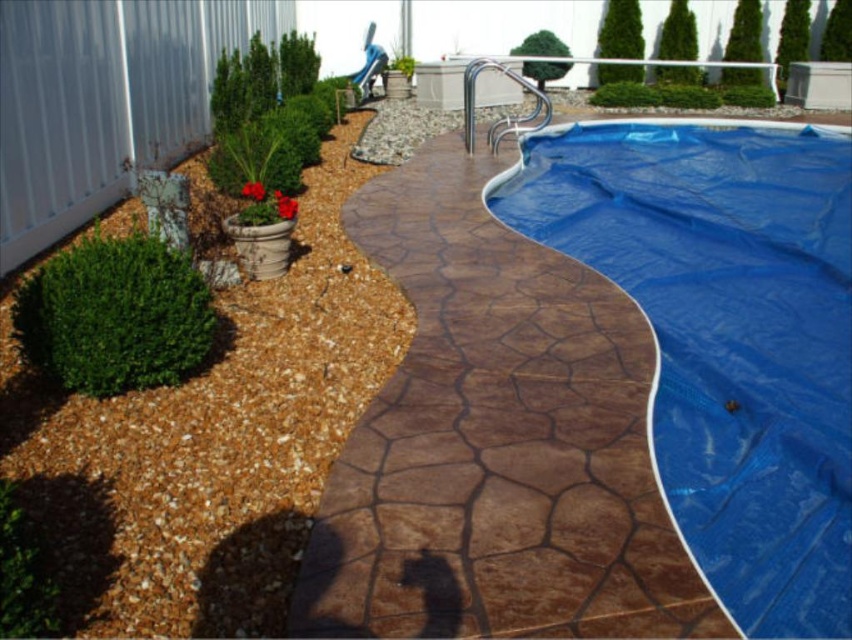
You are planning to place a rectangular picnic blanket that is 2 meters wide. You see the blue tarp at center and the brown gravel mulch at lower left. Which area can accommodate the picnic blanket without folding it?

The blue tarp at center might be wider than brown gravel mulch at lower left, so it is possible that the blue tarp at center can accommodate the picnic blanket without folding it, while the brown gravel mulch at lower left might not have enough width.

You are planning to host a pool party and need to uncover the pool. The brown textured concrete at center is where you want to place the uncovered pool area. Considering the size of the blue tarp at center, will the uncovered area be larger or smaller than the tarp?

The brown textured concrete at center is smaller than the blue tarp at center, so the uncovered area will be smaller than the tarp.

You are standing at the point with coordinates point (519, 168) and want to walk towards the pool. Will you pass by point (674, 588) along the way?

Point (674, 588) is in front of point (519, 168), so yes, you will pass by point (674, 588) on your way to the pool.